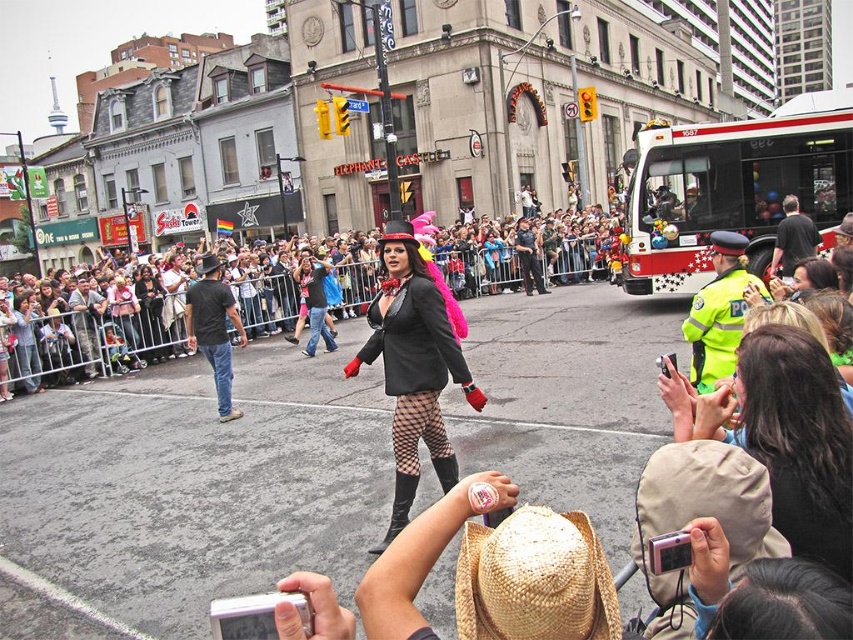
Question: Considering the real-world distances, which object is farthest from the matte black coat at center?

Choices:
 (A) straw hat at lower center
 (B) matte black jacket at center
 (C) brown leather jacket at left
 (D) dark brown hair at lower right

Answer: (B)

Question: Which object is farther from the camera taking this photo?

Choices:
 (A) matte black coat at center
 (B) white plastic bus at right

Answer: (B)

Question: Observing the image, what is the correct spatial positioning of dark brown hair at lower right in reference to brown leather jacket at left?

Choices:
 (A) above
 (B) below

Answer: (A)

Question: Among these points, which one is nearest to the camera?

Choices:
 (A) (828, 435)
 (B) (634, 180)

Answer: (A)

Question: Is white plastic bus at right above brown leather jacket at left?

Choices:
 (A) no
 (B) yes

Answer: (B)

Question: Does white plastic bus at right appear under dark brown hair at lower right?

Choices:
 (A) no
 (B) yes

Answer: (A)